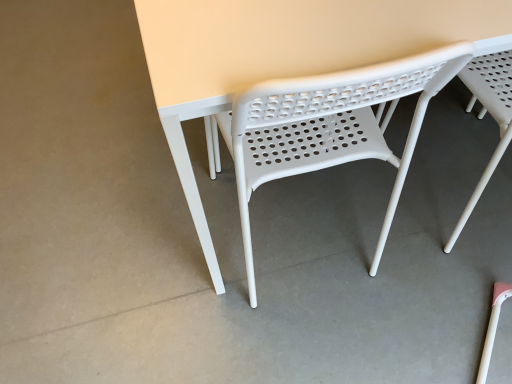
Locate an element on the screen. The image size is (512, 384). white plastic chair at center is located at coordinates (331, 127).

The width and height of the screenshot is (512, 384). Describe the element at coordinates (331, 127) in the screenshot. I see `white plastic chair at center` at that location.

At what (x,y) coordinates should I click in order to perform the action: click on white plastic chair at center. Please return your answer as a coordinate pair (x, y). This screenshot has width=512, height=384. Looking at the image, I should click on (331, 127).